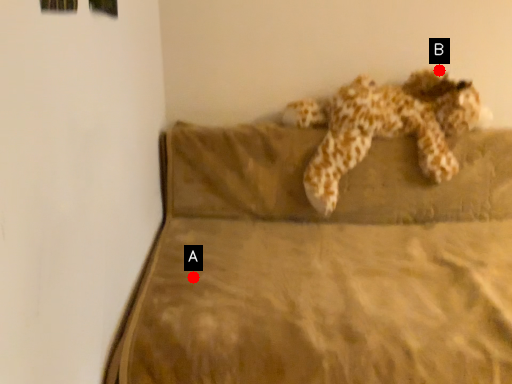
Question: Two points are circled on the image, labeled by A and B beside each circle. Which point is farther to the camera?

Choices:
 (A) A is further
 (B) B is further

Answer: (B)